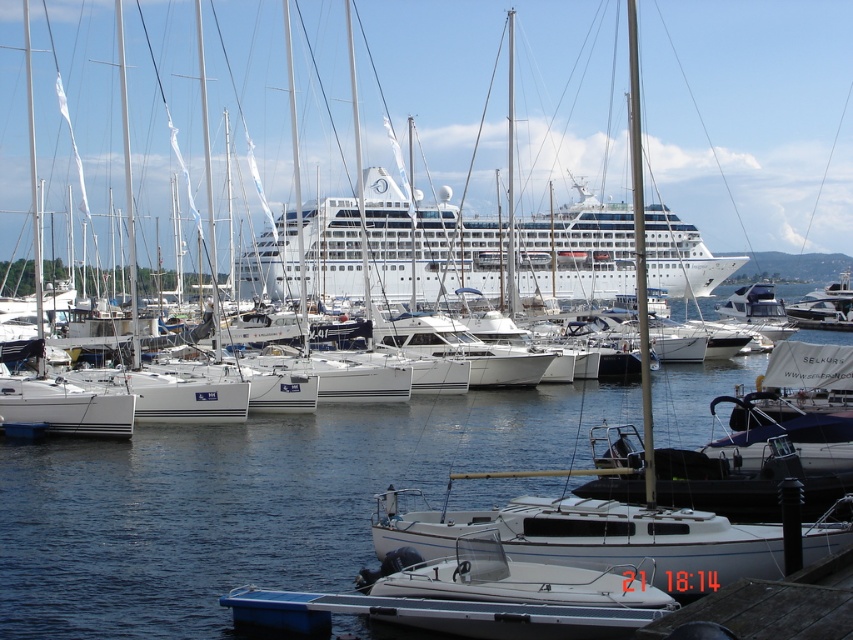
Question: Can you confirm if white glossy cruise ship at center is smaller than white matte motorboat at center?

Choices:
 (A) yes
 (B) no

Answer: (B)

Question: Which object is closer to the camera taking this photo?

Choices:
 (A) white matte motorboat at center
 (B) white glossy cruise ship at center
 (C) wooden dock at lower right

Answer: (C)

Question: Considering the real-world distances, which object is farthest from the white matte motorboat at center?

Choices:
 (A) white glossy cruise ship at center
 (B) blue water at center

Answer: (A)

Question: Does blue water at center have a smaller size compared to white glossy cruise ship at center?

Choices:
 (A) yes
 (B) no

Answer: (A)

Question: Estimate the real-world distances between objects in this image. Which object is farther from the white matte motorboat at center?

Choices:
 (A) wooden dock at lower right
 (B) white glossy cruise ship at center

Answer: (B)

Question: Is white glossy cruise ship at center further to camera compared to white matte motorboat at center?

Choices:
 (A) no
 (B) yes

Answer: (B)